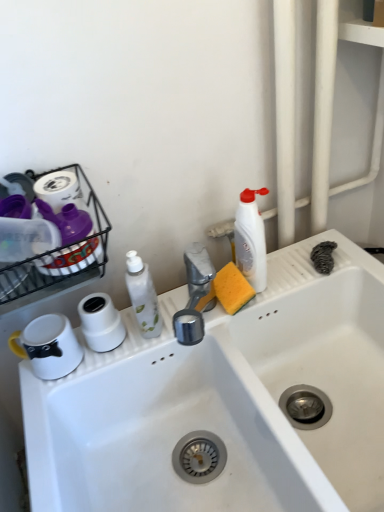
Question: Is white glossy bottle at center, which is the 2th cleaning product from right to left, bigger or smaller than white glossy mug at left?

Choices:
 (A) small
 (B) big

Answer: (B)

Question: Considering the relative positions of white glossy bottle at center, marked as the first cleaning product in a left-to-right arrangement, and white glossy mug at left in the image provided, is white glossy bottle at center, marked as the first cleaning product in a left-to-right arrangement, to the left or to the right of white glossy mug at left?

Choices:
 (A) right
 (B) left

Answer: (A)

Question: Which is nearer to the white glossy bottle at center, marked as the first cleaning product in a left-to-right arrangement?

Choices:
 (A) white glossy mug at left
 (B) white matte toilet paper at center
 (C) white plastic bottle at upper right, which is the first cleaning product in right-to-left order
 (D) white glossy sink at center

Answer: (B)

Question: Which of these objects is positioned closest to the white matte toilet paper at center?

Choices:
 (A) white glossy mug at left
 (B) white glossy bottle at center, marked as the first cleaning product in a left-to-right arrangement
 (C) white glossy sink at center
 (D) white plastic bottle at upper right, which is the first cleaning product in right-to-left order

Answer: (A)